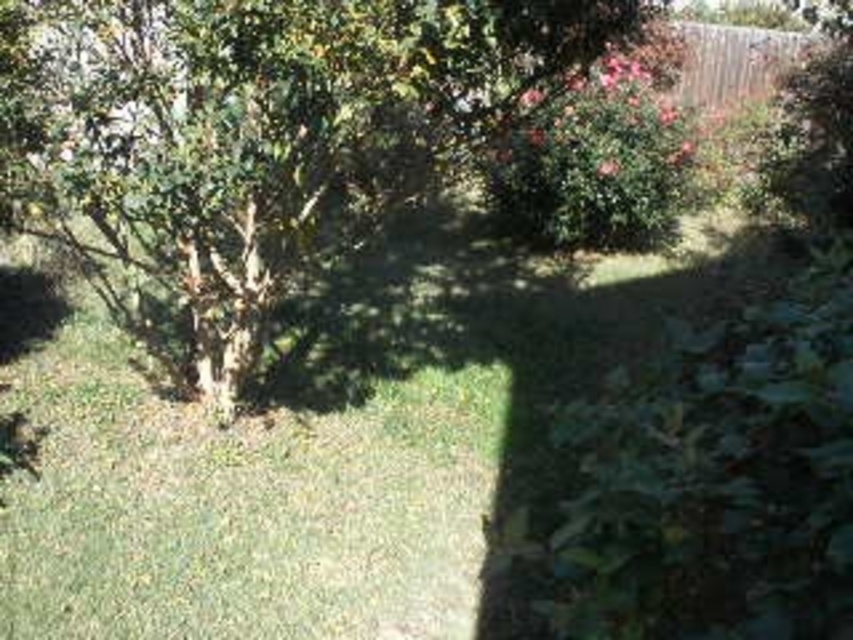
In the garden scene, you see a green leafy tree at center and a green leafy bush at upper center. Which one is positioned to the left of the other?

The green leafy tree at center is positioned to the left of the green leafy bush at upper center.

You are standing in the garden and want to water the green leafy tree at center. Your watering can holds enough water to reach 3 meters. Can you water it without moving closer?

The green leafy tree at center is 3.94 meters away from the viewer, which is beyond the 3 meter range of the watering can. Therefore, you need to move closer to water it.